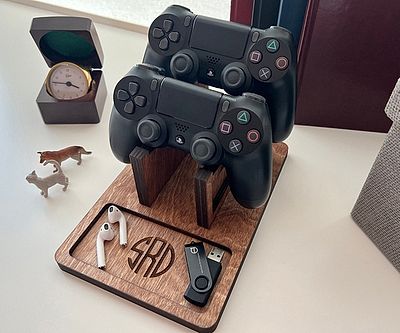
This screenshot has height=333, width=400. I want to click on wooden playstation controller stand, so click(173, 218).